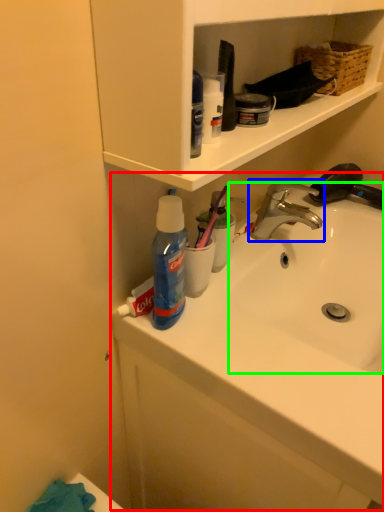
Question: Which object is positioned closest to sink (highlighted by a red box)? Select from tap (highlighted by a blue box) and sink (highlighted by a green box).

Choices:
 (A) tap
 (B) sink

Answer: (B)